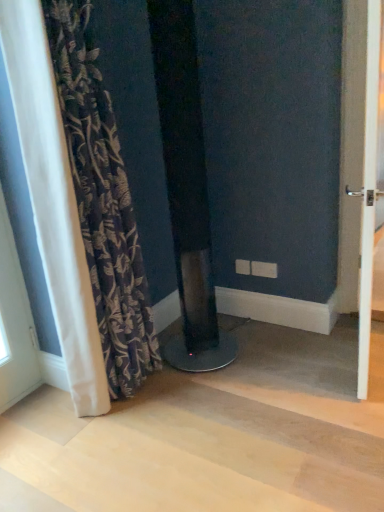
In order to click on vacant space to the right of dark floral fabric curtain at left in this screenshot , I will do `click(190, 398)`.